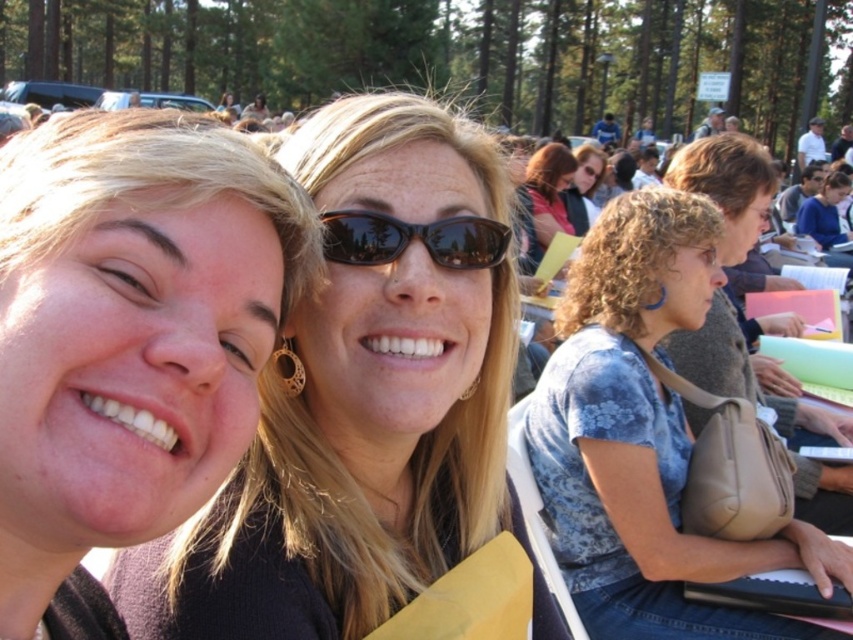
Question: Which object appears farthest from the camera in this image?

Choices:
 (A) black plastic sunglasses at center
 (B) blue floral shirt at center
 (C) matte black sunglasses at center
 (D) matte black hair at left

Answer: (B)

Question: Among these points, which one is farthest from the camera?

Choices:
 (A) (338, 248)
 (B) (70, 195)

Answer: (A)

Question: Is matte black sunglasses at center thinner than blue floral shirt at center?

Choices:
 (A) no
 (B) yes

Answer: (B)

Question: Can you confirm if matte black sunglasses at center is bigger than black plastic sunglasses at center?

Choices:
 (A) no
 (B) yes

Answer: (B)

Question: Is matte black sunglasses at center bigger than blue floral shirt at center?

Choices:
 (A) yes
 (B) no

Answer: (B)

Question: Which point is closer to the camera taking this photo?

Choices:
 (A) (403, 248)
 (B) (187, 522)
 (C) (138, 140)

Answer: (C)